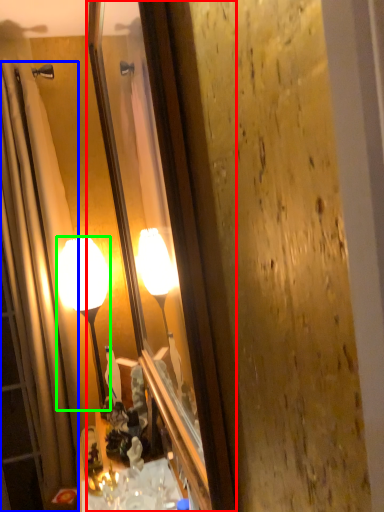
Question: Considering the real-world distances, which object is farthest from mirror (highlighted by a red box)? shower curtain (highlighted by a blue box) or lamp (highlighted by a green box)?

Choices:
 (A) shower curtain
 (B) lamp

Answer: (A)